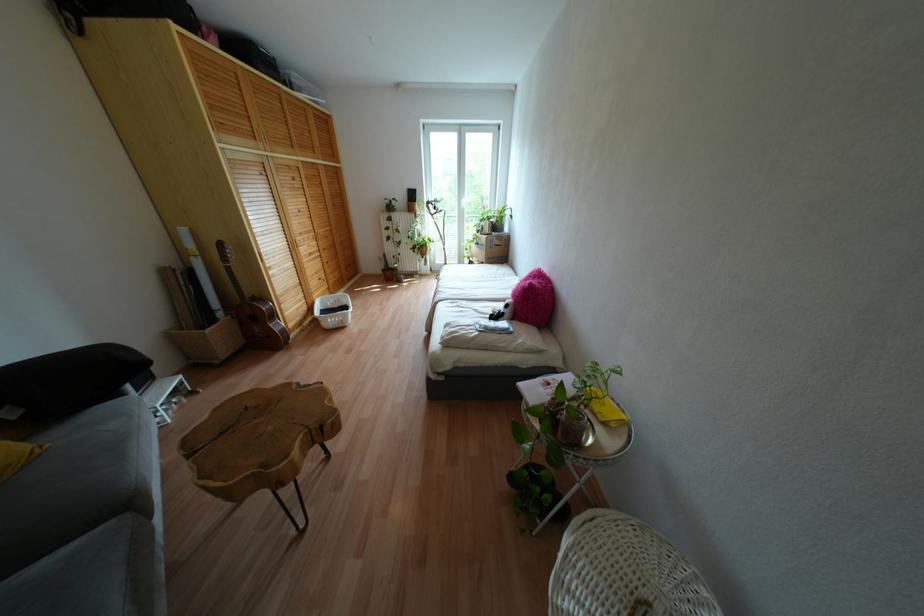
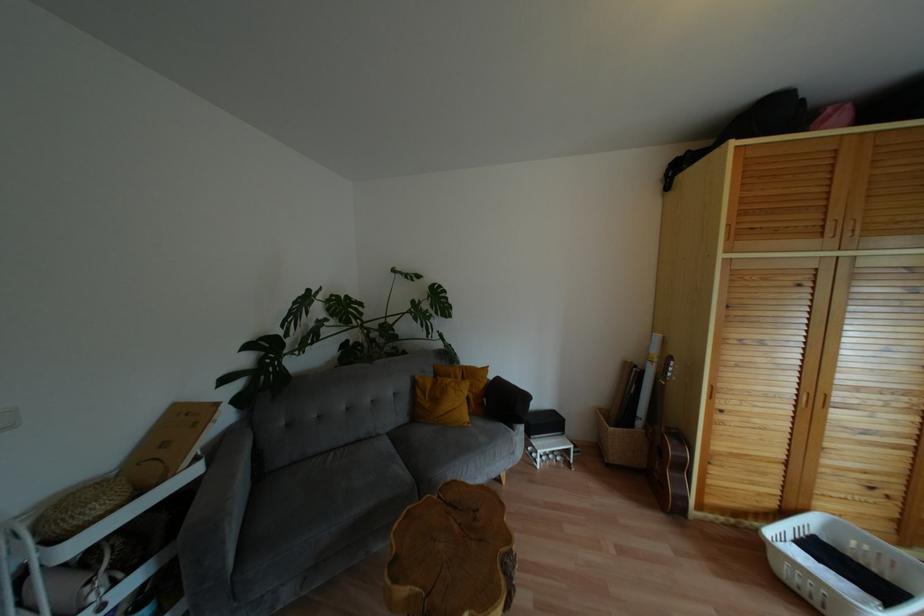
Question: The camera is either moving clockwise (left) or counter-clockwise (right) around the object. The first image is from the beginning of the video and the second image is from the end. Is the camera moving left or right when shooting the video?

Choices:
 (A) Left
 (B) Right

Answer: (B)